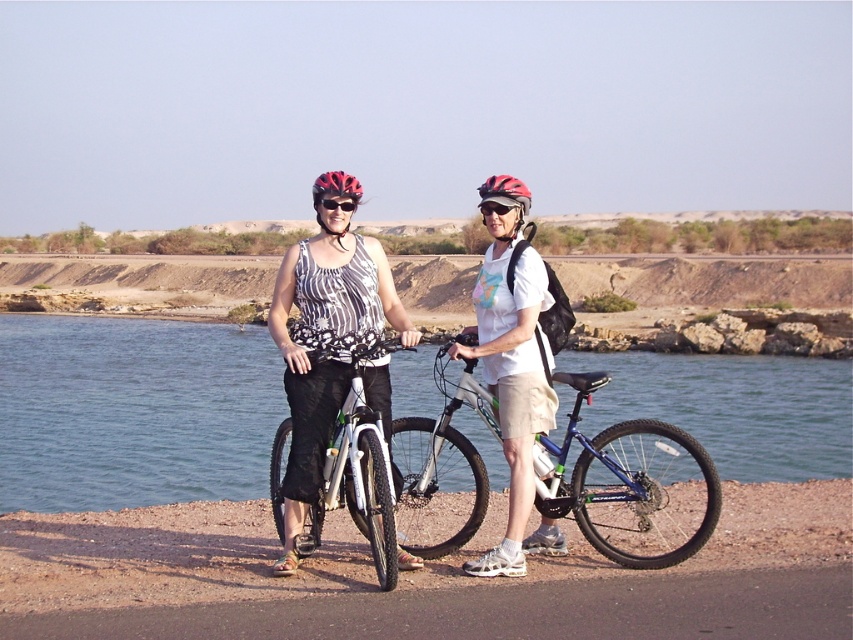
Question: Which object is positioned farthest from the black plastic goggles at center?

Choices:
 (A) matte white bicycle at center
 (B) white matte shirt at center

Answer: (B)

Question: Does matte white bicycle at center have a larger size compared to white matte mountain bike at center?

Choices:
 (A) no
 (B) yes

Answer: (B)

Question: Which object appears farthest from the camera in this image?

Choices:
 (A) white matte mountain bike at center
 (B) matte white bicycle at center
 (C) blue water at center

Answer: (C)

Question: Can you confirm if blue water at center is positioned above matte black helmet at center?

Choices:
 (A) no
 (B) yes

Answer: (A)

Question: Can you confirm if white matte mountain bike at center is positioned below matte black helmet at center?

Choices:
 (A) yes
 (B) no

Answer: (A)

Question: Which point is closer to the camera?

Choices:
 (A) (682, 516)
 (B) (492, 184)

Answer: (B)